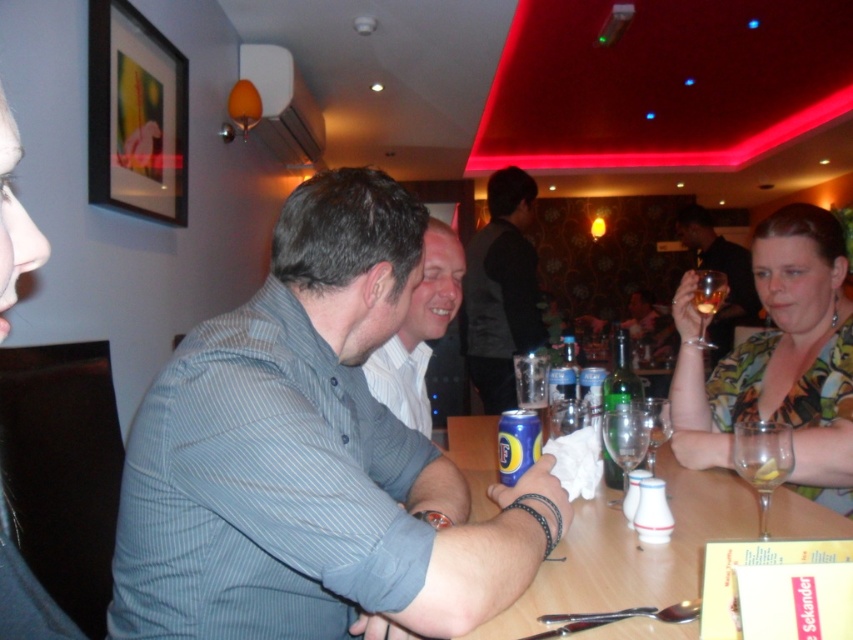
What are the coordinates of the printed fabric blouse at right?

The printed fabric blouse at right is located at coordinates point (778, 358).

In the scene shown: You are a waiter in a restaurant. You need to deliver a drink to the customer wearing the striped cotton shirt at center. The drink is currently on the table at the clear glass at table right. Can you reach the customer directly without moving any objects?

The striped cotton shirt at center is closer to the viewer than the clear glass at table right, so the waiter can reach the customer directly without moving any objects because the shirt is nearer to the waiter than the glass.